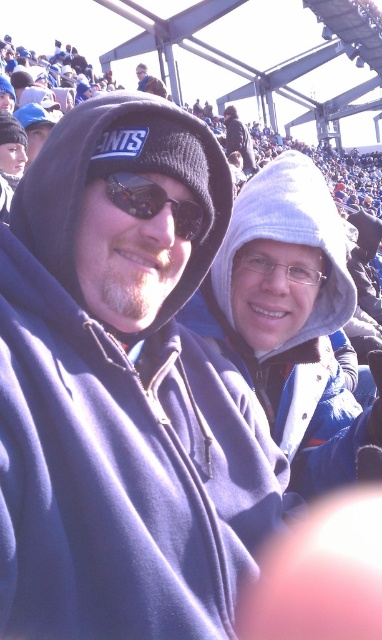
Who is positioned more to the left, sunglasses at center or white fleece hat at center?

From the viewer's perspective, sunglasses at center appears more on the left side.

Is sunglasses at center thinner than white fleece hat at center?

Correct, sunglasses at center's width is less than white fleece hat at center's.

This screenshot has width=382, height=640. In order to click on sunglasses at center in this screenshot , I will do `click(153, 202)`.

Can you confirm if white fleece hat at center is taller than matte black beanie at upper center?

Yes, white fleece hat at center is taller than matte black beanie at upper center.

Can you confirm if white fleece hat at center is smaller than matte black beanie at upper center?

Yes.

Which is behind, point (255, 168) or point (148, 81)?

The point (255, 168) is behind.

Identify the location of white fleece hat at center. This screenshot has height=640, width=382. (239, 140).

Is blue fleece hoodie at center to the right of clear plastic glasses at center from the viewer's perspective?

Incorrect, blue fleece hoodie at center is not on the right side of clear plastic glasses at center.

Can you confirm if blue fleece hoodie at center is taller than clear plastic glasses at center?

Yes, blue fleece hoodie at center is taller than clear plastic glasses at center.

Which is in front, point (76, 436) or point (246, 253)?

Point (76, 436) is in front.

This screenshot has width=382, height=640. What are the coordinates of `blue fleece hoodie at center` in the screenshot? It's located at (123, 394).